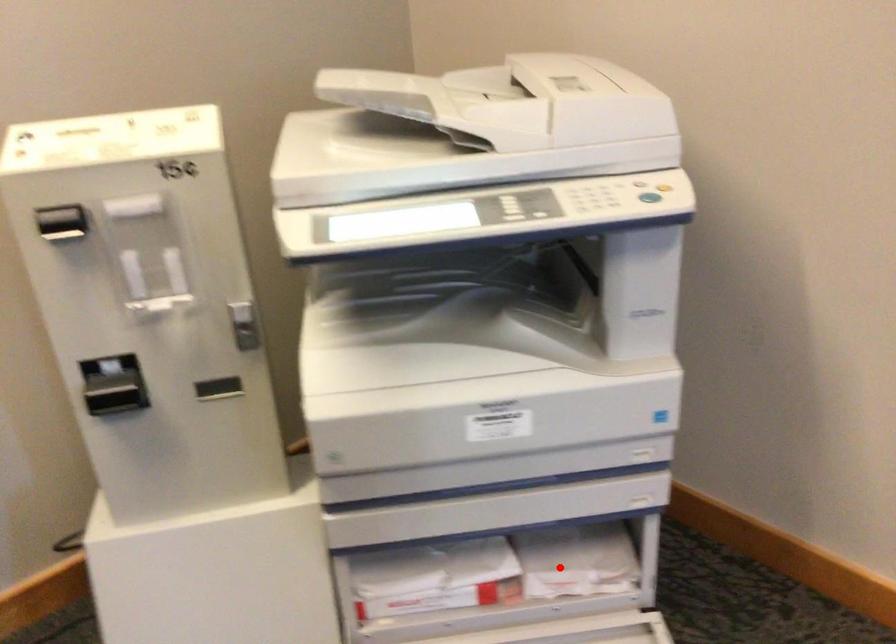
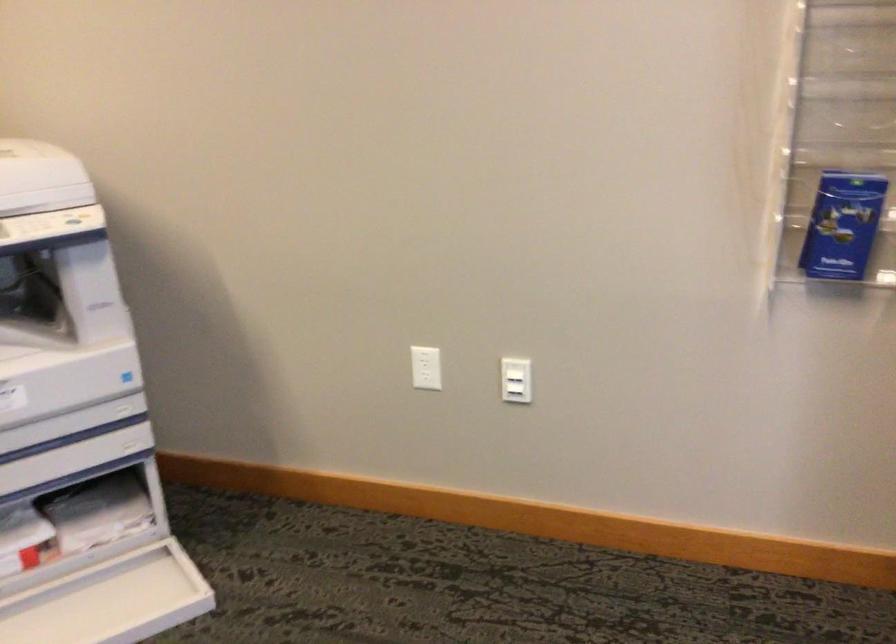
Question: I am providing you with two images of the same scene from different viewpoints. In image1, a red point is highlighted. Considering the same 3D point in image2, which of the following is correct?

Choices:
 (A) It is closer
 (B) It is farther

Answer: (B)